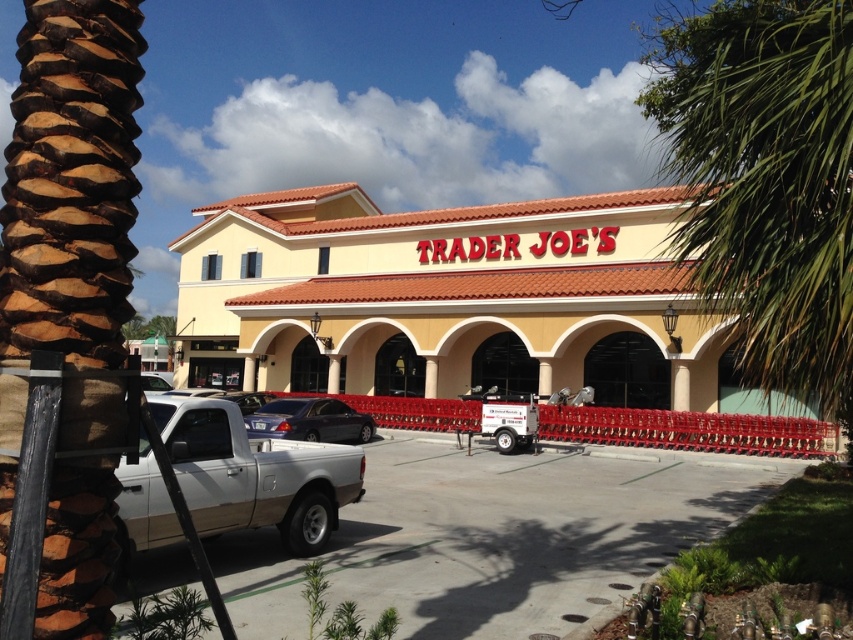
Image resolution: width=853 pixels, height=640 pixels. What do you see at coordinates (766, 180) in the screenshot?
I see `green leafy palm tree at upper right` at bounding box center [766, 180].

Who is more distant from viewer, (780, 180) or (312, 428)?

The point (312, 428) is more distant.

What do you see at coordinates (766, 180) in the screenshot?
I see `green leafy palm tree at upper right` at bounding box center [766, 180].

Where is `green leafy palm tree at upper right`? The width and height of the screenshot is (853, 640). green leafy palm tree at upper right is located at coordinates (766, 180).

Which is more to the left, brown textured palm tree at left or satin black sedan at center?

satin black sedan at center is more to the left.

Find the location of a particular element. The height and width of the screenshot is (640, 853). brown textured palm tree at left is located at coordinates (71, 182).

Is point (32, 131) behind point (352, 413)?

No, it is not.

This screenshot has height=640, width=853. I want to click on brown textured palm tree at left, so 71,182.

Who is positioned more to the left, yellow stucco building at center or brown textured palm tree at left?

From the viewer's perspective, yellow stucco building at center appears more on the left side.

Between point (714, 371) and point (74, 573), which one is positioned in front?

Positioned in front is point (74, 573).

What do you see at coordinates (451, 300) in the screenshot? I see `yellow stucco building at center` at bounding box center [451, 300].

Locate an element on the screen. The image size is (853, 640). yellow stucco building at center is located at coordinates (451, 300).